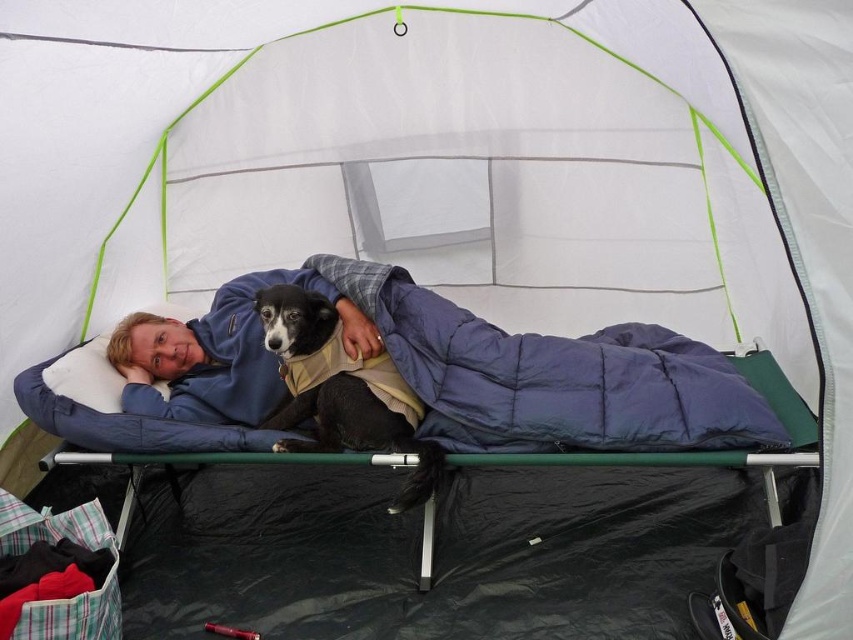
Question: Can you confirm if blue down-filled sleeping bag at center is positioned to the right of black soft fur dog at center?

Choices:
 (A) no
 (B) yes

Answer: (B)

Question: Which point is farther to the camera?

Choices:
 (A) blue down-filled sleeping bag at center
 (B) black soft fur dog at center

Answer: (B)

Question: Which of the following is the farthest from the observer?

Choices:
 (A) (297, 296)
 (B) (490, 429)

Answer: (A)

Question: Does blue down-filled sleeping bag at center have a smaller size compared to black soft fur dog at center?

Choices:
 (A) yes
 (B) no

Answer: (B)

Question: Is blue down-filled sleeping bag at center above black soft fur dog at center?

Choices:
 (A) yes
 (B) no

Answer: (A)

Question: Among these objects, which one is nearest to the camera?

Choices:
 (A) blue down-filled sleeping bag at center
 (B) black soft fur dog at center

Answer: (A)